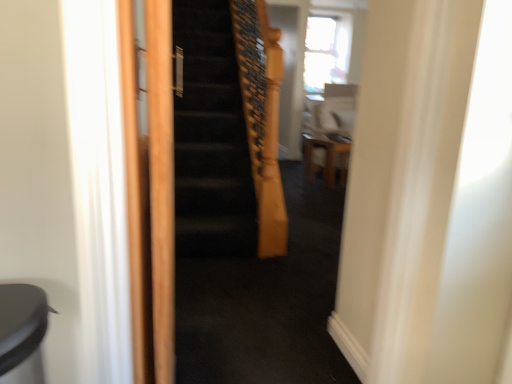
In order to face wooden stool at center, should I rotate leftwards or rightwards?

Rotate right and turn 9.723 degrees.

Where is `wooden stool at center`? Image resolution: width=512 pixels, height=384 pixels. wooden stool at center is located at coordinates (325, 158).

In the scene shown: Measure the distance between point (317,151) and camera.

Point (317,151) and camera are 4.38 meters apart.

Describe the element at coordinates (325, 158) in the screenshot. I see `wooden stool at center` at that location.

Describe the element at coordinates (149, 186) in the screenshot. I see `wooden screen door at center` at that location.

In order to face wooden screen door at center, should I rotate leftwards or rightwards?

Rotate left and turn 12.366 degrees.

I want to click on wooden screen door at center, so click(149, 186).

Where is `wooden stool at center`? wooden stool at center is located at coordinates (325, 158).

Can you confirm if wooden stool at center is positioned to the right of wooden screen door at center?

Yes, wooden stool at center is to the right of wooden screen door at center.

Which is in front, wooden stool at center or wooden screen door at center?

wooden screen door at center.

Does point (305, 139) lie in front of point (141, 367)?

No.

From the image's perspective, between wooden stool at center and wooden screen door at center, which one is located above?

wooden stool at center, from the image's perspective.

From a real-world perspective, which object stands above the other?

wooden screen door at center, from a real-world perspective.

Does wooden stool at center have a greater width compared to wooden screen door at center?

Yes, wooden stool at center is wider than wooden screen door at center.

Does wooden stool at center have a lesser height compared to wooden screen door at center?

Indeed, wooden stool at center has a lesser height compared to wooden screen door at center.

Considering the relative sizes of wooden stool at center and wooden screen door at center in the image provided, is wooden stool at center bigger than wooden screen door at center?

Yes, wooden stool at center is bigger than wooden screen door at center.

Is wooden stool at center completely or partially outside of wooden screen door at center?

Yes, wooden stool at center is outside of wooden screen door at center.

Is wooden stool at center placed right next to wooden screen door at center?

wooden stool at center and wooden screen door at center are clearly separated.

Could you tell me if wooden stool at center is facing wooden screen door at center?

No, wooden stool at center does not turn towards wooden screen door at center.

This screenshot has width=512, height=384. What are the coordinates of `screen door that is on the left side of wooden stool at center` in the screenshot? It's located at (149, 186).

Based on the photo, which is more to the left, wooden screen door at center or wooden stool at center?

wooden screen door at center is more to the left.

Which object is further away from the camera taking this photo, wooden screen door at center or wooden stool at center?

wooden stool at center is further from the camera.

Considering the points (142, 123) and (321, 153), which point is behind, point (142, 123) or point (321, 153)?

The point (321, 153) is behind.

From the image's perspective, is wooden screen door at center on wooden stool at center?

No.

From a real-world perspective, does wooden screen door at center sit lower than wooden stool at center?

No, from a real-world perspective, wooden screen door at center is not below wooden stool at center.

Considering the sizes of objects wooden screen door at center and wooden stool at center in the image provided, who is wider, wooden screen door at center or wooden stool at center?

With larger width is wooden stool at center.

Is wooden screen door at center taller or shorter than wooden stool at center?

wooden screen door at center is taller than wooden stool at center.

Does wooden screen door at center have a smaller size compared to wooden stool at center?

Correct, wooden screen door at center occupies less space than wooden stool at center.

Is wooden screen door at center not inside wooden stool at center?

Yes, wooden screen door at center is outside of wooden stool at center.

Are wooden screen door at center and wooden stool at center making contact?

No, wooden screen door at center is not beside wooden stool at center.

Based on the photo, is wooden screen door at center turned away from wooden stool at center?

No, wooden screen door at center is not facing the opposite direction of wooden stool at center.

Can you tell me how much wooden screen door at center and wooden stool at center differ in facing direction?

They differ by 64.4 degrees in their facing directions.

Measure the distance between wooden screen door at center and wooden stool at center.

wooden screen door at center and wooden stool at center are 10.34 feet apart from each other.

This screenshot has width=512, height=384. I want to click on furniture that is on the right side of wooden screen door at center, so click(325, 158).

Image resolution: width=512 pixels, height=384 pixels. I want to click on screen door below the wooden stool at center (from the image's perspective), so click(x=149, y=186).

Where is `furniture behind the wooden screen door at center`? The image size is (512, 384). furniture behind the wooden screen door at center is located at coordinates (325, 158).